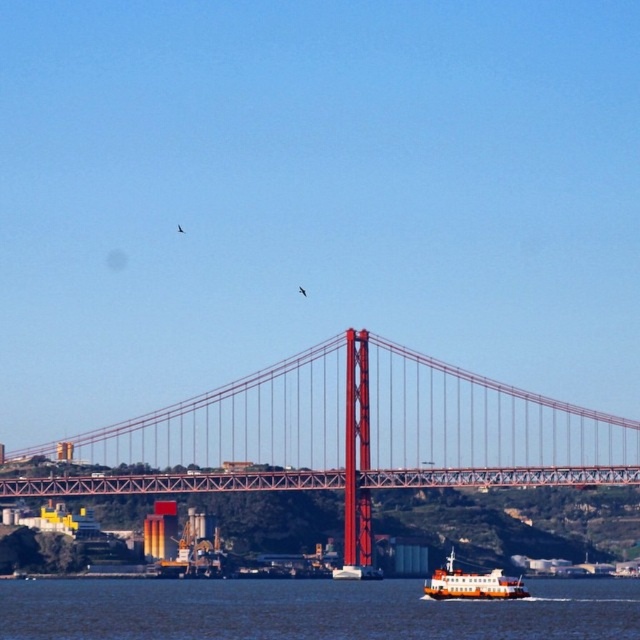
Question: Which point is closer to the camera?

Choices:
 (A) (364, 614)
 (B) (465, 580)
 (C) (349, 378)

Answer: (C)

Question: Which object is positioned closest to the orange matte ferryboat at lower center?

Choices:
 (A) metallic red suspension bridge at center
 (B) blue water at lower center

Answer: (B)

Question: Which of the following is the closest to the observer?

Choices:
 (A) (122, 582)
 (B) (317, 416)

Answer: (B)

Question: Can you confirm if metallic red suspension bridge at center is smaller than blue water at lower center?

Choices:
 (A) no
 (B) yes

Answer: (A)

Question: Is metallic red suspension bridge at center bigger than blue water at lower center?

Choices:
 (A) no
 (B) yes

Answer: (B)

Question: Does metallic red suspension bridge at center lie behind blue water at lower center?

Choices:
 (A) no
 (B) yes

Answer: (A)